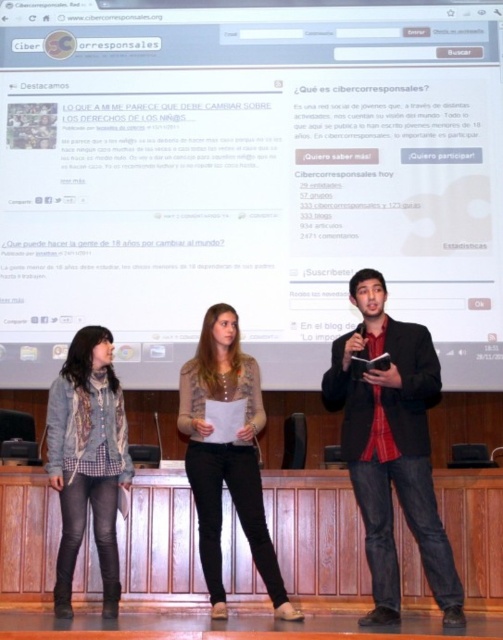
Between matte black blazer at center and denim jacket at lower left, which one is positioned lower?

denim jacket at lower left is below.

Which is in front, point (402, 344) or point (116, 410)?

Point (402, 344)

The width and height of the screenshot is (503, 640). Describe the element at coordinates (391, 448) in the screenshot. I see `matte black blazer at center` at that location.

Find the location of `matte black blazer at center`. matte black blazer at center is located at coordinates (391, 448).

Can you confirm if white glossy projection screen at upper center is taller than matte black blazer at center?

No.

What do you see at coordinates (248, 179) in the screenshot? I see `white glossy projection screen at upper center` at bounding box center [248, 179].

Where is `white glossy projection screen at upper center`? The width and height of the screenshot is (503, 640). white glossy projection screen at upper center is located at coordinates (248, 179).

Does white glossy projection screen at upper center have a larger size compared to black jeans at center?

No, white glossy projection screen at upper center is not bigger than black jeans at center.

Is point (471, 12) behind point (237, 396)?

Yes.

The image size is (503, 640). What are the coordinates of `white glossy projection screen at upper center` in the screenshot? It's located at (248, 179).